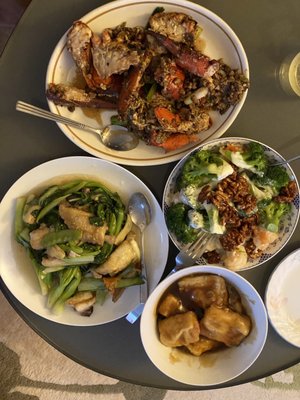
Image resolution: width=300 pixels, height=400 pixels. In order to click on small plate in this screenshot , I will do `click(286, 310)`.